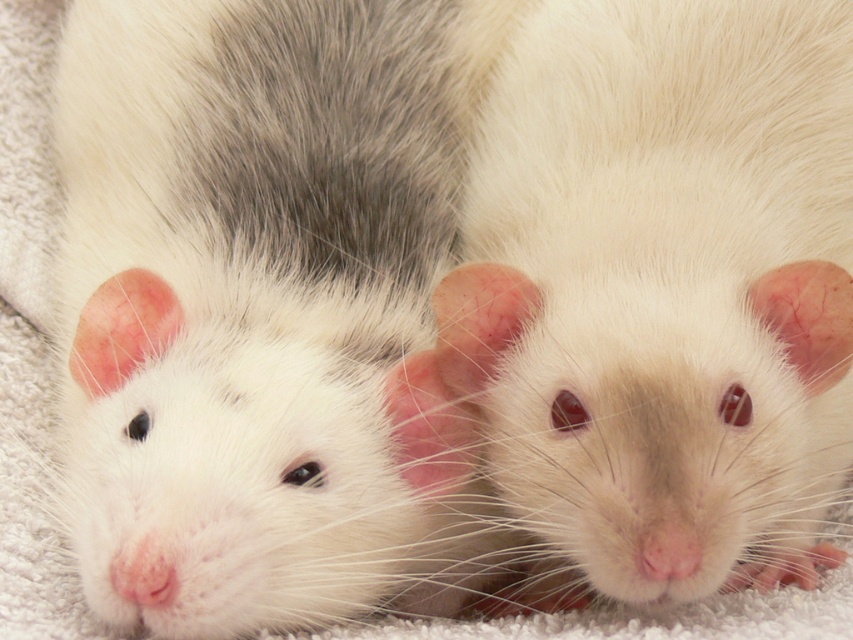
You are observing two hamsters resting on a soft fabric. The scene shows a white soft fur hamster at center and a white fur hamster at center. Which hamster is positioned higher?

The white soft fur hamster at center is positioned higher than the white fur hamster at center.